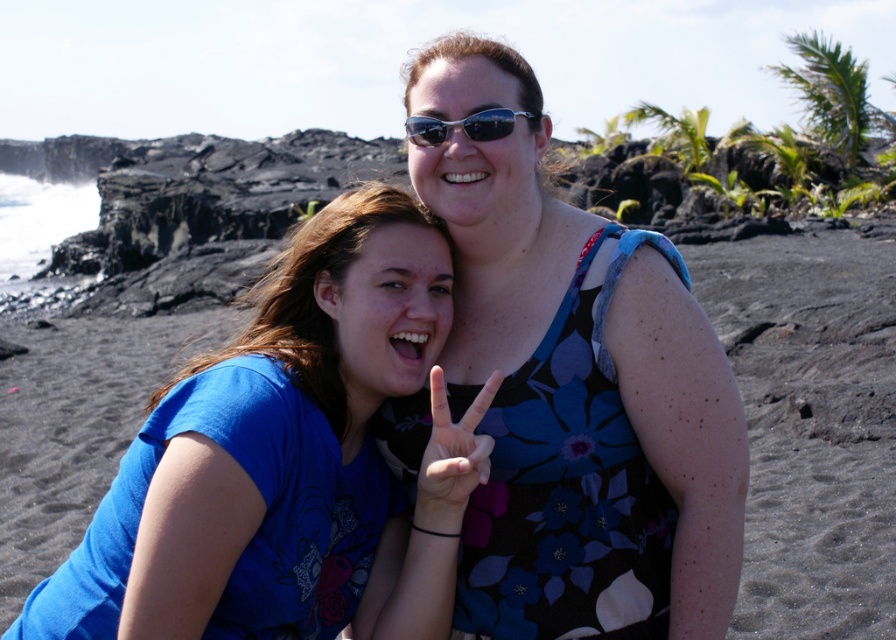
Who is shorter, floral dress at center or black plastic sunglasses at center?

Standing shorter between the two is black plastic sunglasses at center.

Can you confirm if floral dress at center is bigger than black plastic sunglasses at center?

Yes, floral dress at center is bigger than black plastic sunglasses at center.

Find the location of `floral dress at center`. floral dress at center is located at coordinates (583, 412).

Is the position of blue cotton shirt at center less distant than that of black plastic sunglasses at center?

Yes, blue cotton shirt at center is in front of black plastic sunglasses at center.

Between blue cotton shirt at center and black plastic sunglasses at center, which one appears on the left side from the viewer's perspective?

blue cotton shirt at center is more to the left.

Which is behind, point (287, 420) or point (500, 132)?

The point (500, 132) is more distant.

Identify the location of blue cotton shirt at center. (289, 460).

Is floral dress at center thinner than blue cotton shirt at center?

Yes.

Which of these two, floral dress at center or blue cotton shirt at center, stands taller?

Standing taller between the two is floral dress at center.

Is point (507, 614) more distant than point (343, 556)?

No, it is not.

Identify the location of floral dress at center. This screenshot has height=640, width=896. (583, 412).